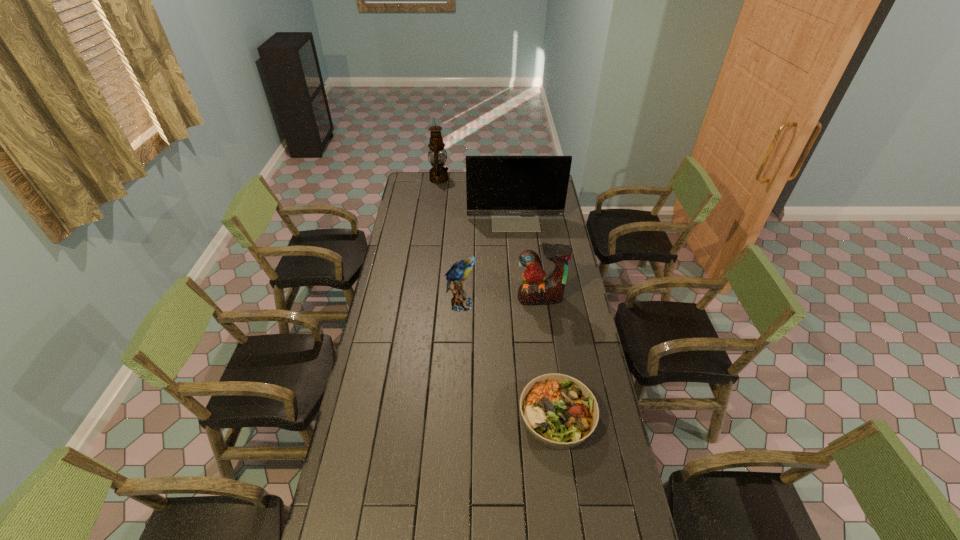
You are a GUI agent. You are given a task and a screenshot of the screen. Output one action in this format:
    pyautogui.click(x=<x>, y=<y>)
    Task: Click on the vacant position located on the face of the left parrot
    
    Given the screenshot: What is the action you would take?
    pyautogui.click(x=562, y=304)

You are a GUI agent. You are given a task and a screenshot of the screen. Output one action in this format:
    pyautogui.click(x=<x>, y=<y>)
    Task: Click on the free spot located on the front of the salad plate
    This screenshot has height=540, width=960.
    Given the screenshot: What is the action you would take?
    pyautogui.click(x=567, y=495)

This screenshot has height=540, width=960. In order to click on object that is at the far edge in this screenshot , I will do `click(438, 174)`.

The height and width of the screenshot is (540, 960). Identify the location of object that is at the left edge. (438, 174).

Identify the location of computer monitor that is at the right edge. The width and height of the screenshot is (960, 540). (514, 190).

The height and width of the screenshot is (540, 960). Identify the location of parrot positioned at the right edge. (535, 290).

At what (x,y) coordinates should I click in order to perform the action: click on salad plate present at the right edge. Please return your answer as a coordinate pair (x, y). Looking at the image, I should click on (559, 412).

Locate an element on the screen. The height and width of the screenshot is (540, 960). object that is at the far left corner is located at coordinates (438, 174).

Locate an element on the screen. The width and height of the screenshot is (960, 540). vacant space at the far edge of the desktop is located at coordinates (453, 184).

You are a GUI agent. You are given a task and a screenshot of the screen. Output one action in this format:
    pyautogui.click(x=<x>, y=<y>)
    Task: Click on the vacant space at the left edge
    The width and height of the screenshot is (960, 540).
    Given the screenshot: What is the action you would take?
    pyautogui.click(x=410, y=222)